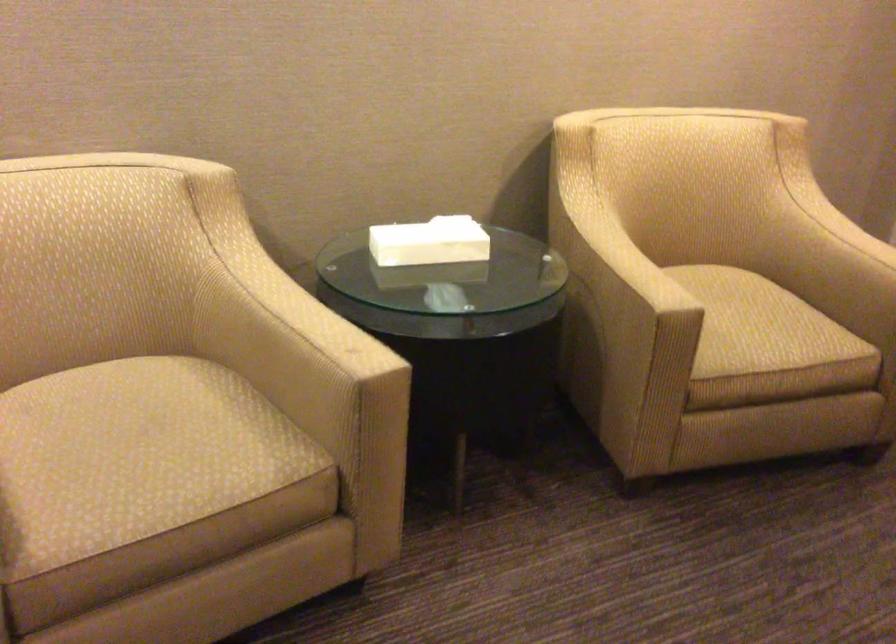
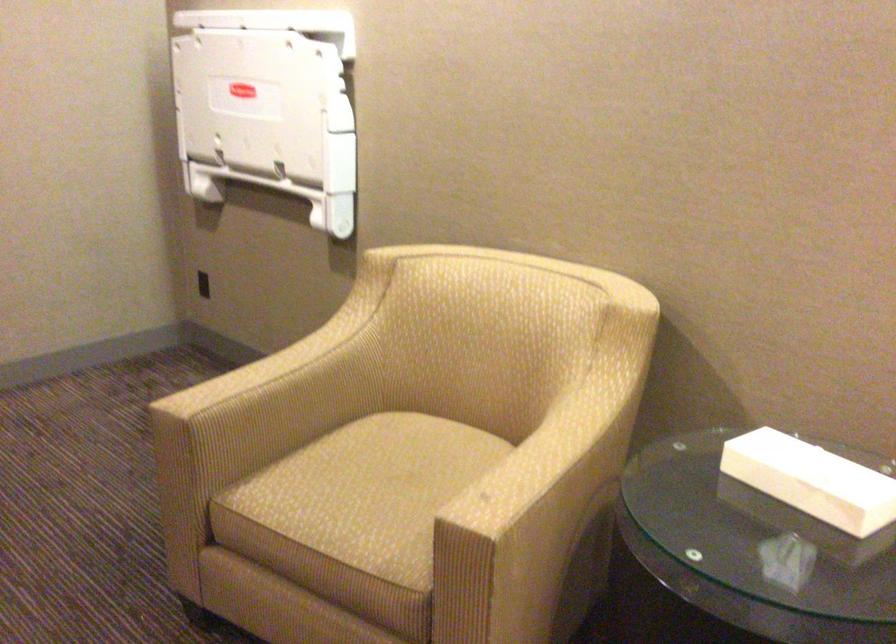
Find the pixel in the second image that matches point 151,450 in the first image.

(371, 491)